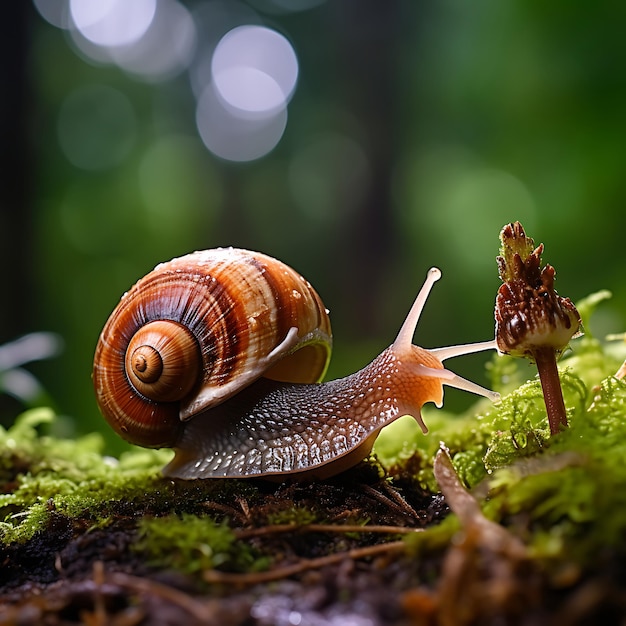
Where is `lights`? lights is located at coordinates (270, 71).